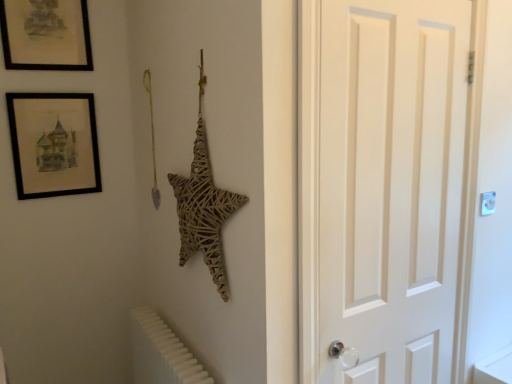
Question: Considering the relative sizes of white plastic radiator at lower left and white plastic light switch at upper right in the image provided, is white plastic radiator at lower left bigger than white plastic light switch at upper right?

Choices:
 (A) no
 (B) yes

Answer: (B)

Question: Is white plastic radiator at lower left thinner than white plastic light switch at upper right?

Choices:
 (A) no
 (B) yes

Answer: (A)

Question: From the image's perspective, does white plastic radiator at lower left appear lower than white plastic light switch at upper right?

Choices:
 (A) yes
 (B) no

Answer: (A)

Question: Is white plastic radiator at lower left wider than white plastic light switch at upper right?

Choices:
 (A) yes
 (B) no

Answer: (A)

Question: Could white plastic light switch at upper right be considered to be inside white plastic radiator at lower left?

Choices:
 (A) no
 (B) yes

Answer: (A)

Question: Could you tell me if white plastic radiator at lower left is facing white plastic light switch at upper right?

Choices:
 (A) no
 (B) yes

Answer: (A)

Question: Is black matte picture frame at upper left, the 1th picture frame when ordered from top to bottom, at the left side of white wooden door at right?

Choices:
 (A) no
 (B) yes

Answer: (B)

Question: Considering the relative sizes of black matte picture frame at upper left, the 1th picture frame when ordered from top to bottom, and white wooden door at right in the image provided, is black matte picture frame at upper left, the 1th picture frame when ordered from top to bottom, wider than white wooden door at right?

Choices:
 (A) no
 (B) yes

Answer: (B)

Question: Can you confirm if black matte picture frame at upper left, the 1th picture frame when ordered from top to bottom, is positioned to the right of white wooden door at right?

Choices:
 (A) no
 (B) yes

Answer: (A)

Question: Considering the relative sizes of black matte picture frame at upper left, the 1th picture frame when ordered from top to bottom, and white wooden door at right in the image provided, is black matte picture frame at upper left, the 1th picture frame when ordered from top to bottom, shorter than white wooden door at right?

Choices:
 (A) yes
 (B) no

Answer: (A)

Question: Can you confirm if black matte picture frame at upper left, the 2th picture frame from the bottom, is taller than white wooden door at right?

Choices:
 (A) yes
 (B) no

Answer: (B)

Question: From the image's perspective, would you say black matte picture frame at upper left, the 1th picture frame when ordered from top to bottom, is positioned over white wooden door at right?

Choices:
 (A) no
 (B) yes

Answer: (B)

Question: Is black matte picture frame at upper left, positioned as the 1th picture frame in bottom-to-top order, bigger than white plastic light switch at upper right?

Choices:
 (A) yes
 (B) no

Answer: (A)